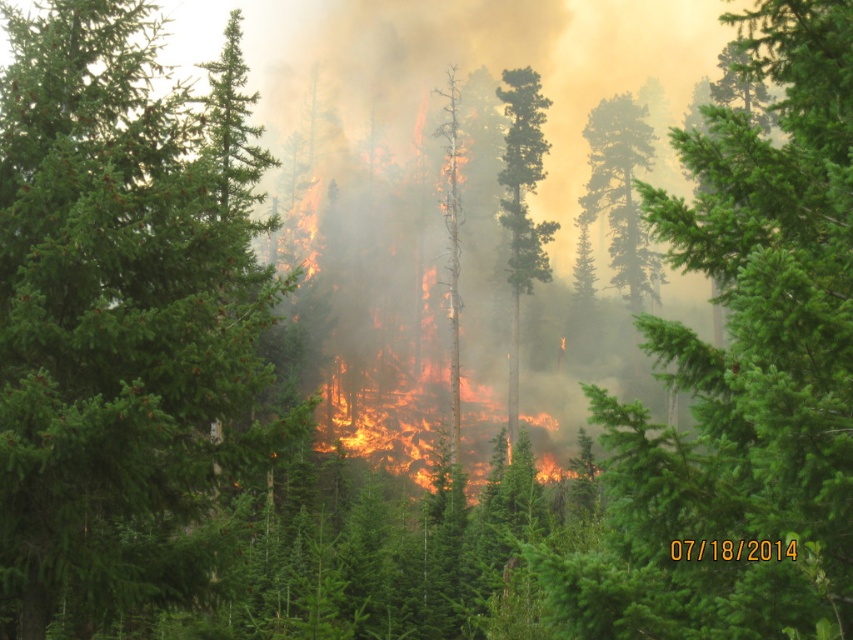
You are a firefighter assessing the forest fire scene. You notice a green matte tree at center. Based on its 2D coordinates, where is the green matte tree located in the image?

The green matte tree at center is located at the 2D coordinates point [741,372].

You are a firefighter assessing the forest fire scene. You notice two trees in the center of the image, the green matte tree at center and the green smooth bark tree at center. Which tree is wider in terms of its trunk? Please base your answer on the visible trunks in the image.

The green matte tree at center has a wider trunk than the green smooth bark tree at center, as its width surpasses the latter.

You are a firefighter trying to navigate through the forest fire scene. You need to reach a safe zone located at coordinates point 0.5, 0.143. Is the green evergreen tree at center in your way?

The green evergreen tree at center is located exactly at point (x=120, y=314), which is very close to your target coordinates of (x=120, y=320). This means the tree is directly in your path, so you would need to navigate around it to reach the safe zone.